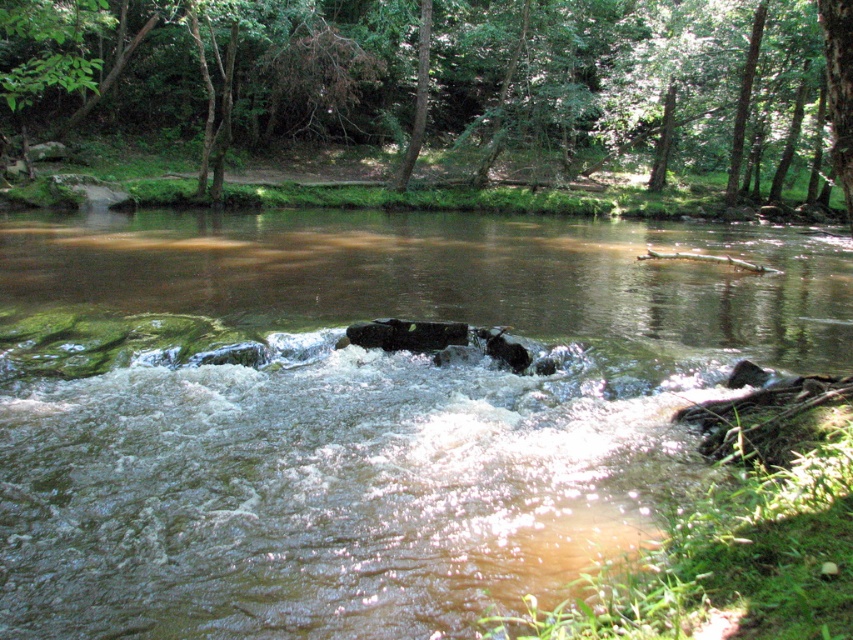
Question: Where is brown smooth rock at center located in relation to green rough bark tree at upper center in the image?

Choices:
 (A) above
 (B) below

Answer: (B)

Question: Which point is farther from the camera taking this photo?

Choices:
 (A) (492, 161)
 (B) (407, 161)

Answer: (A)

Question: Considering the relative positions of brown smooth rock at center and green rough bark tree at upper center in the image provided, where is brown smooth rock at center located with respect to green rough bark tree at upper center?

Choices:
 (A) above
 (B) below

Answer: (B)

Question: Among these objects, which one is nearest to the camera?

Choices:
 (A) brown smooth rock at center
 (B) green leafy tree at upper center
 (C) green rough bark tree at upper center

Answer: (A)

Question: Which of these objects is positioned closest to the green leafy tree at upper center?

Choices:
 (A) green rough bark tree at upper center
 (B) brown smooth rock at center

Answer: (A)

Question: Can you confirm if brown smooth rock at center is wider than green leafy tree at upper center?

Choices:
 (A) yes
 (B) no

Answer: (B)